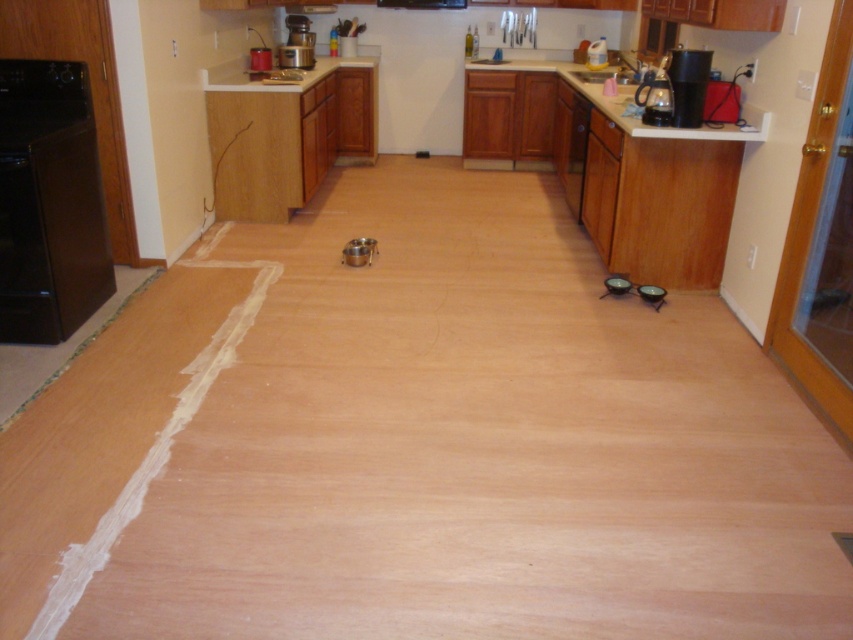
Question: Does black matte oven at left have a lesser width compared to white laminate counter top at upper center?

Choices:
 (A) no
 (B) yes

Answer: (B)

Question: Which object is the closest to the black matte oven at left?

Choices:
 (A) white laminate counter top at upper center
 (B) black plastic exhaust hood at upper center

Answer: (A)

Question: Which point is closer to the camera?

Choices:
 (A) white glossy sink at upper center
 (B) white laminate counter top at upper center
 (C) black matte oven at left

Answer: (C)

Question: Is black plastic kettle at upper right to the left of white glossy sink at upper center from the viewer's perspective?

Choices:
 (A) yes
 (B) no

Answer: (A)

Question: Does white laminate counter top at upper center lie behind black plastic kettle at upper right?

Choices:
 (A) yes
 (B) no

Answer: (A)

Question: Which point appears closest to the camera in this image?

Choices:
 (A) (376, 3)
 (B) (296, 54)

Answer: (B)